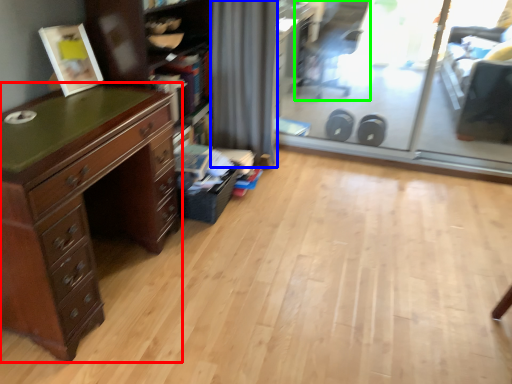
Question: Based on their relative distances, which object is nearer to chest of drawers (highlighted by a red box)? Choose from curtain (highlighted by a blue box) and swivel chair (highlighted by a green box).

Choices:
 (A) curtain
 (B) swivel chair

Answer: (A)